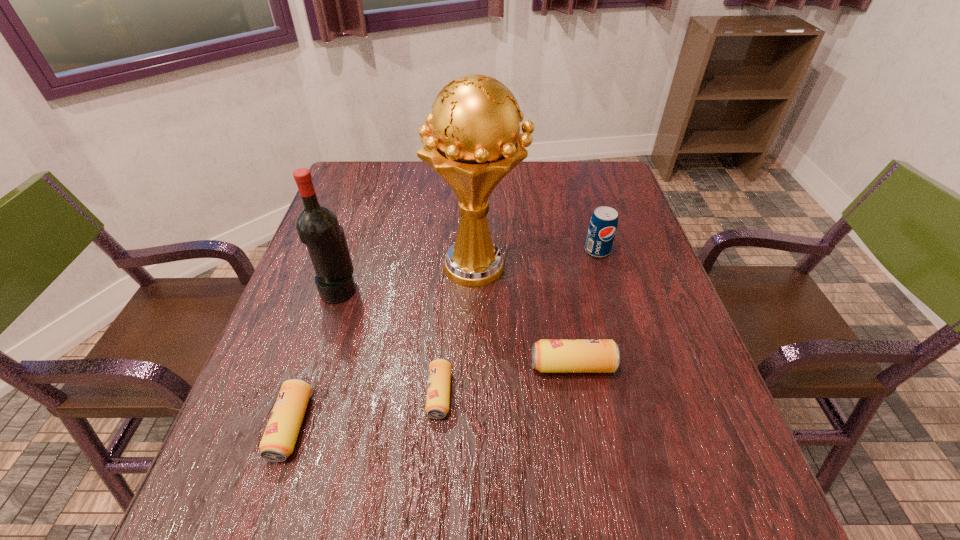
I want to click on free space at the far edge, so click(407, 173).

Where is `vacant space at the near edge of the desktop`? vacant space at the near edge of the desktop is located at coordinates (399, 417).

The height and width of the screenshot is (540, 960). What are the coordinates of `free space at the right edge of the desktop` in the screenshot? It's located at (662, 367).

Locate an element on the screen. The height and width of the screenshot is (540, 960). vacant space at the far left corner of the desktop is located at coordinates (382, 186).

Find the location of a particular element. Image resolution: width=960 pixels, height=540 pixels. vacant space at the near left corner of the desktop is located at coordinates (307, 426).

Where is `vacant region between the tallest object and the second tallest beer can`? Image resolution: width=960 pixels, height=540 pixels. vacant region between the tallest object and the second tallest beer can is located at coordinates (384, 346).

Where is `vacant point located between the third tallest object and the leftmost beer can`? Image resolution: width=960 pixels, height=540 pixels. vacant point located between the third tallest object and the leftmost beer can is located at coordinates (444, 338).

Identify the location of vacant area between the rightmost beer can and the shortest beer can. (506, 380).

The height and width of the screenshot is (540, 960). In order to click on free spot between the third tallest object and the leftmost beer can in this screenshot , I will do `click(444, 338)`.

You are a GUI agent. You are given a task and a screenshot of the screen. Output one action in this format:
    pyautogui.click(x=<x>, y=<y>)
    Task: Click on the free space between the leftmost beer can and the rightmost object
    Image resolution: width=960 pixels, height=540 pixels.
    Given the screenshot: What is the action you would take?
    pyautogui.click(x=444, y=338)